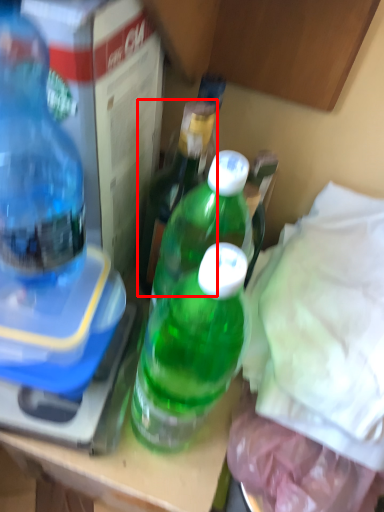
Question: From the image's perspective, considering the relative positions of bottle (annotated by the red box) and bottle in the image provided, where is bottle (annotated by the red box) located with respect to the staircase?

Choices:
 (A) above
 (B) below

Answer: (B)